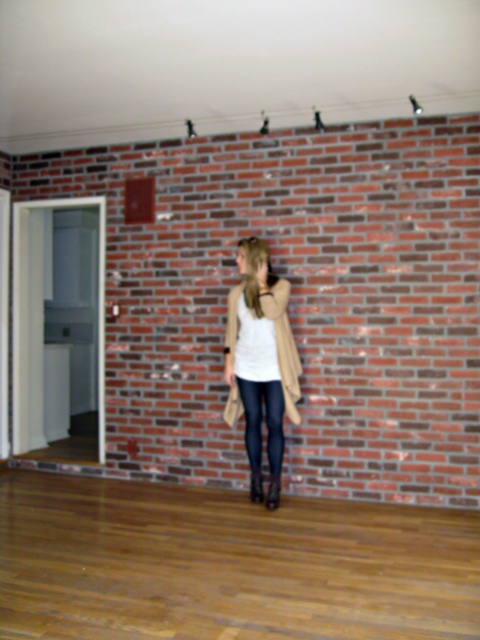
You are a fashion stylist observing the beige textured coat at center and the black leather leggings at center. Which clothing item is positioned more to the left?

The beige textured coat at center is positioned to the left of the black leather leggings at center, so the beige textured coat at center is more to the left.